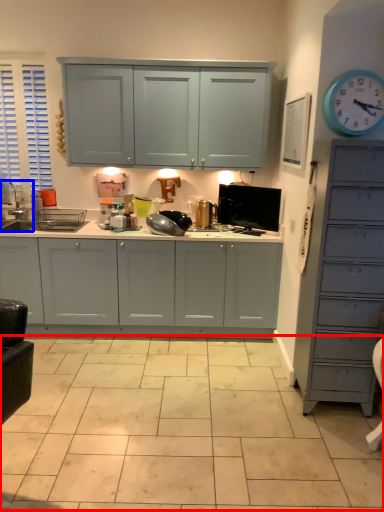
Question: Which of the following is the closest to the observer, ceramic tile (highlighted by a red box) or sink (highlighted by a blue box)?

Choices:
 (A) ceramic tile
 (B) sink

Answer: (A)